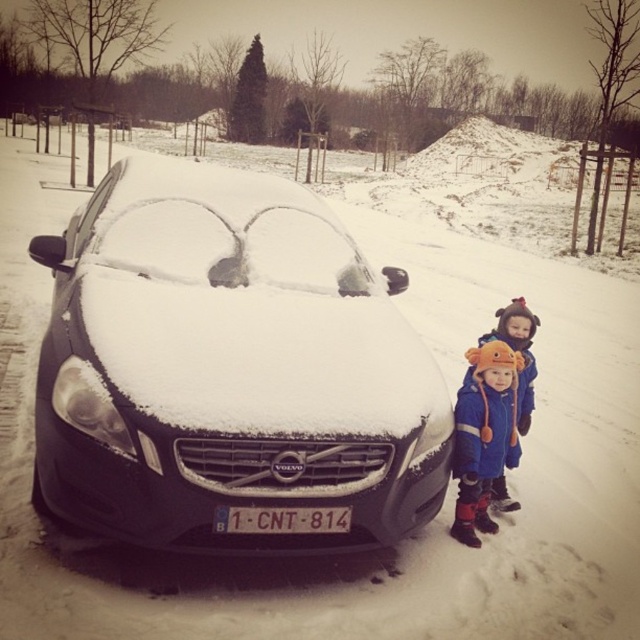
Question: Does snow-covered metallic car at center have a larger size compared to blue fuzzy hat at lower right?

Choices:
 (A) yes
 (B) no

Answer: (A)

Question: Which point is closer to the camera?

Choices:
 (A) white plastic license plate at center
 (B) snow-covered metallic car at center
 (C) orange fleece hat at lower right

Answer: (B)

Question: Observing the image, what is the correct spatial positioning of blue fuzzy hat at lower right in reference to white plastic license plate at center?

Choices:
 (A) right
 (B) left

Answer: (A)

Question: Which object is the closest to the snow-covered metallic car at center?

Choices:
 (A) blue fuzzy hat at lower right
 (B) white plastic license plate at center

Answer: (B)

Question: Can you confirm if orange fleece hat at lower right is bigger than blue fuzzy hat at lower right?

Choices:
 (A) no
 (B) yes

Answer: (A)

Question: Which object appears closest to the camera in this image?

Choices:
 (A) orange fleece hat at lower right
 (B) blue fuzzy hat at lower right
 (C) white plastic license plate at center
 (D) snow-covered metallic car at center

Answer: (D)